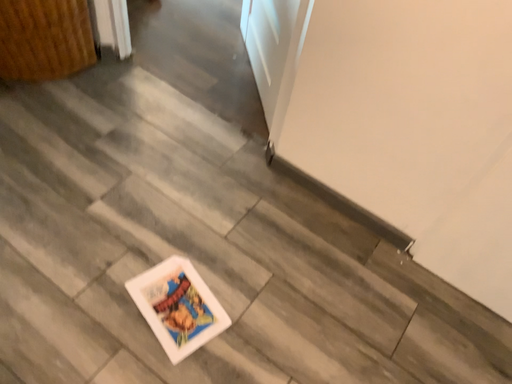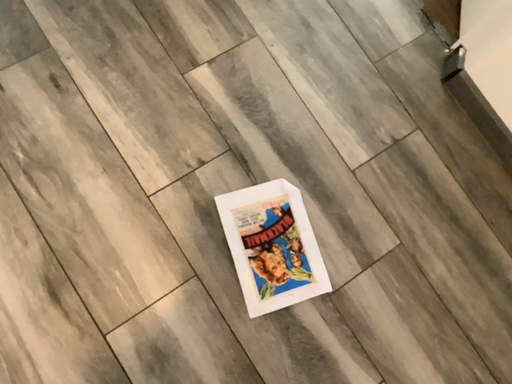
Question: How did the camera likely rotate when shooting the video?

Choices:
 (A) rotated downward
 (B) rotated upward

Answer: (A)